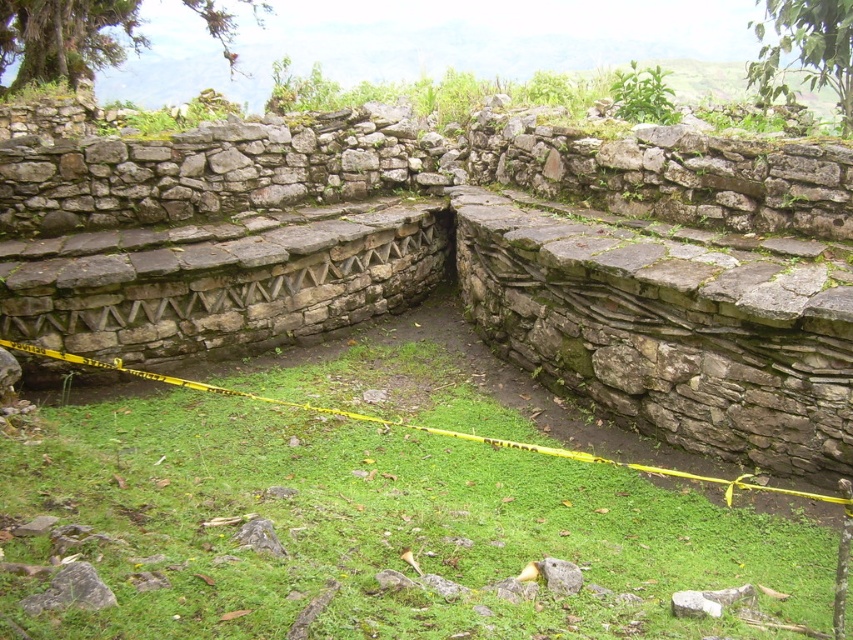
Question: Does natural stone wall at center come in front of green grass at center?

Choices:
 (A) no
 (B) yes

Answer: (A)

Question: Among these objects, which one is farthest from the camera?

Choices:
 (A) natural stone wall at center
 (B) green grass at center

Answer: (A)

Question: Among these objects, which one is farthest from the camera?

Choices:
 (A) natural stone wall at center
 (B) green grass at center

Answer: (A)

Question: Does natural stone wall at center appear on the right side of green grass at center?

Choices:
 (A) yes
 (B) no

Answer: (A)

Question: From the image, what is the correct spatial relationship of natural stone wall at center in relation to green grass at center?

Choices:
 (A) below
 (B) above

Answer: (B)